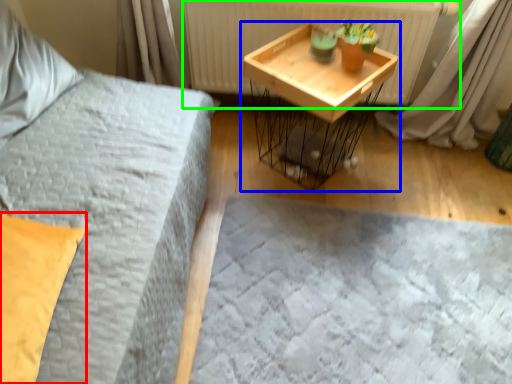
Question: Estimate the real-world distances between objects in this image. Which object is closer to pillow (highlighted by a red box), table (highlighted by a blue box) or radiator (highlighted by a green box)?

Choices:
 (A) table
 (B) radiator

Answer: (A)